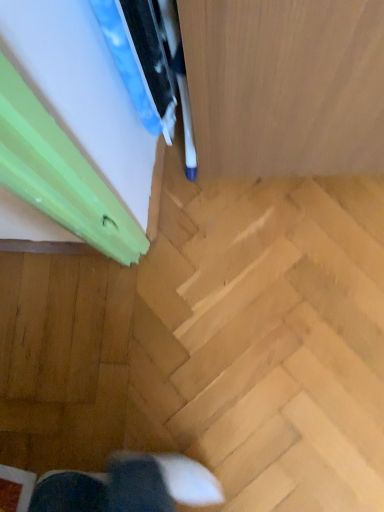
Describe the element at coordinates (266, 339) in the screenshot. The height and width of the screenshot is (512, 384). I see `wooden stairs at center` at that location.

This screenshot has height=512, width=384. Find the location of `wooden stairs at center`. wooden stairs at center is located at coordinates (266, 339).

Measure the distance between point (298, 210) and camera.

A distance of 1.14 meters exists between point (298, 210) and camera.

Find the location of a particular element. wooden stairs at center is located at coordinates (266, 339).